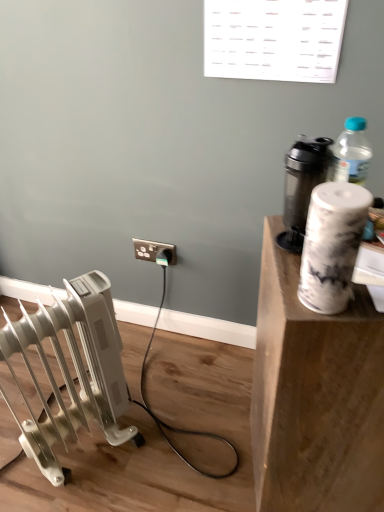
Locate an element on the screen. This screenshot has width=384, height=512. vacant area that is situated to the right of white plastic radiator at lower left is located at coordinates (172, 441).